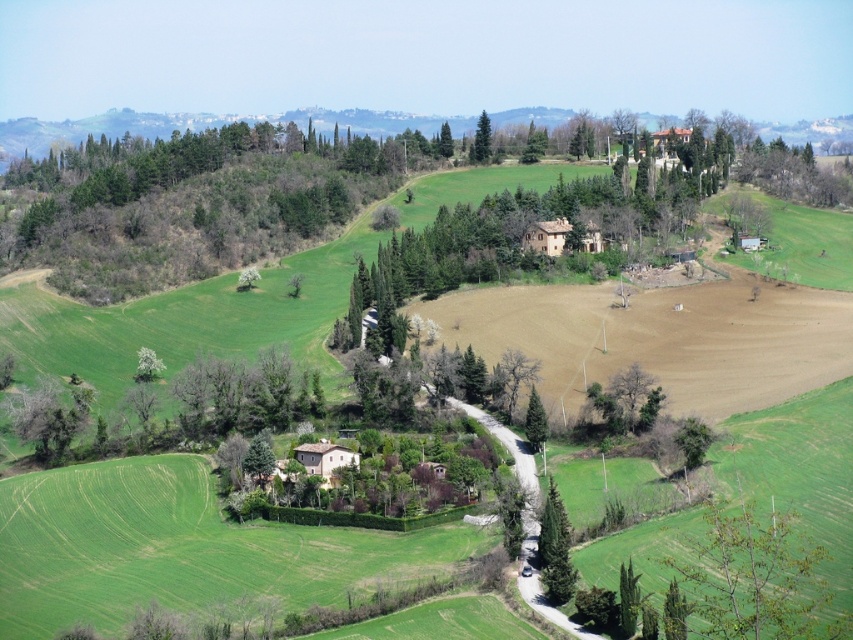
Question: Among these objects, which one is farthest from the camera?

Choices:
 (A) green leafy tree at lower left
 (B) green leafy tree at lower right
 (C) green textured tree at center

Answer: (A)

Question: Which object is positioned farthest from the green leafy tree at upper center?

Choices:
 (A) green leafy tree at lower right
 (B) green leafy tree at center
 (C) green textured tree at center

Answer: (A)

Question: Does green leafy tree at center appear on the left side of green textured tree at center?

Choices:
 (A) no
 (B) yes

Answer: (B)

Question: Can you confirm if green leafy tree at lower left is thinner than green leafy tree at center?

Choices:
 (A) no
 (B) yes

Answer: (A)

Question: Which object is the farthest from the green textured tree at center?

Choices:
 (A) green leafy tree at center
 (B) green leafy tree at lower right
 (C) green leafy tree at upper center

Answer: (C)

Question: Is green leafy tree at center positioned at the back of green leafy tree at upper center?

Choices:
 (A) yes
 (B) no

Answer: (B)